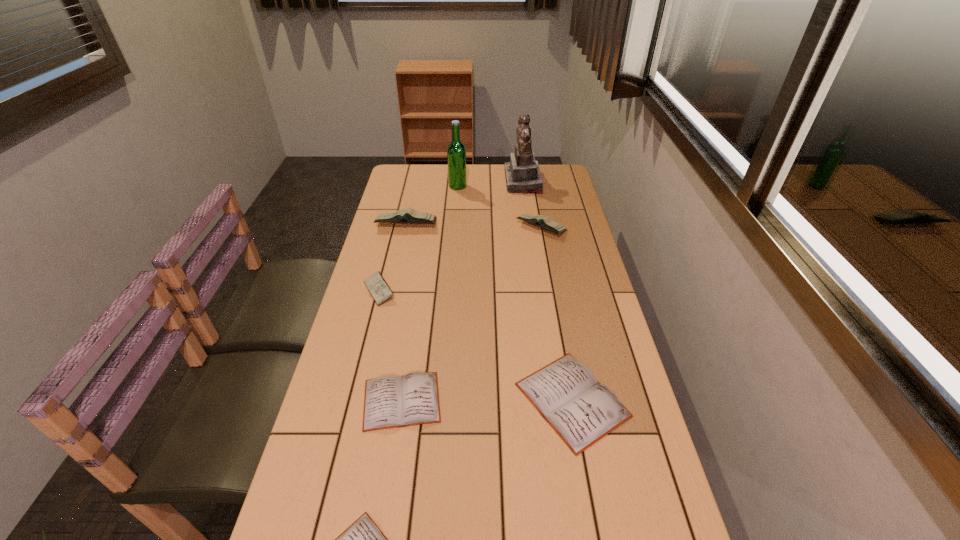
Identify which diary is the nearest to the second shortest diary. Please provide its 2D coordinates. Your answer should be formatted as a tuple, i.e. [(x, y)], where the tuple contains the x and y coordinates of a point satisfying the conditions above.

[(363, 539)]

The image size is (960, 540). I want to click on the second closest pink diary to the figurine, so 410,215.

The image size is (960, 540). Identify the location of pink diary that is the second closest to the figurine. (410, 215).

This screenshot has height=540, width=960. I want to click on white diary that stands as the second closest to the seventh tallest object, so click(581, 410).

Locate which white diary ranks in proximity to the rightmost pink diary. Please provide its 2D coordinates. Your answer should be formatted as a tuple, i.e. [(x, y)], where the tuple contains the x and y coordinates of a point satisfying the conditions above.

[(581, 410)]

Image resolution: width=960 pixels, height=540 pixels. I want to click on vacant space that satisfies the following two spatial constraints: 1. on the back side of the fifth shortest diary; 2. on the right side of the third shortest diary, so click(540, 227).

Identify the location of vacant region that satisfies the following two spatial constraints: 1. on the front-facing side of the figurine; 2. on the front side of the seventh tallest object. (556, 401).

What are the coordinates of `free point that satisfies the following two spatial constraints: 1. on the back side of the fourth tallest diary; 2. on the right side of the second tallest diary` in the screenshot? It's located at pyautogui.click(x=540, y=227).